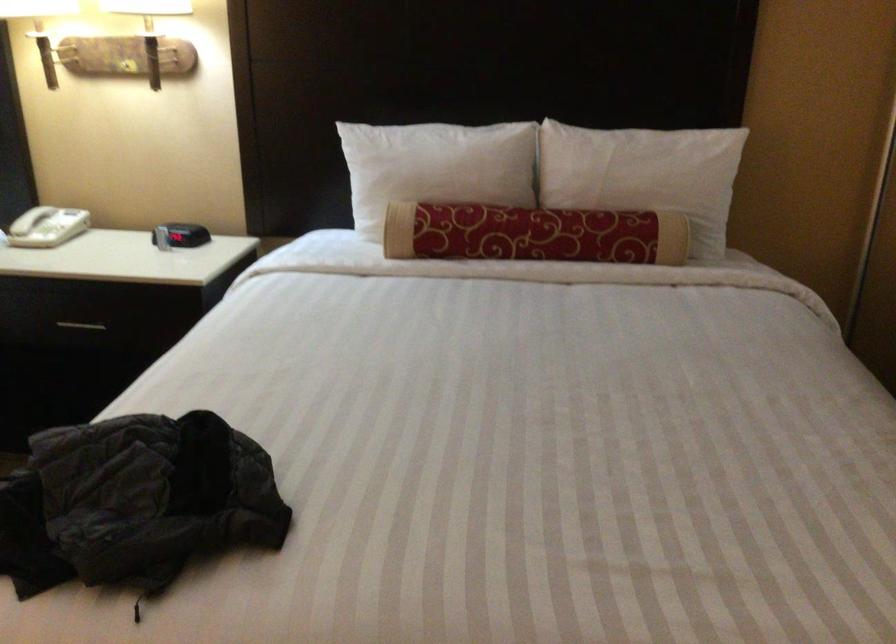
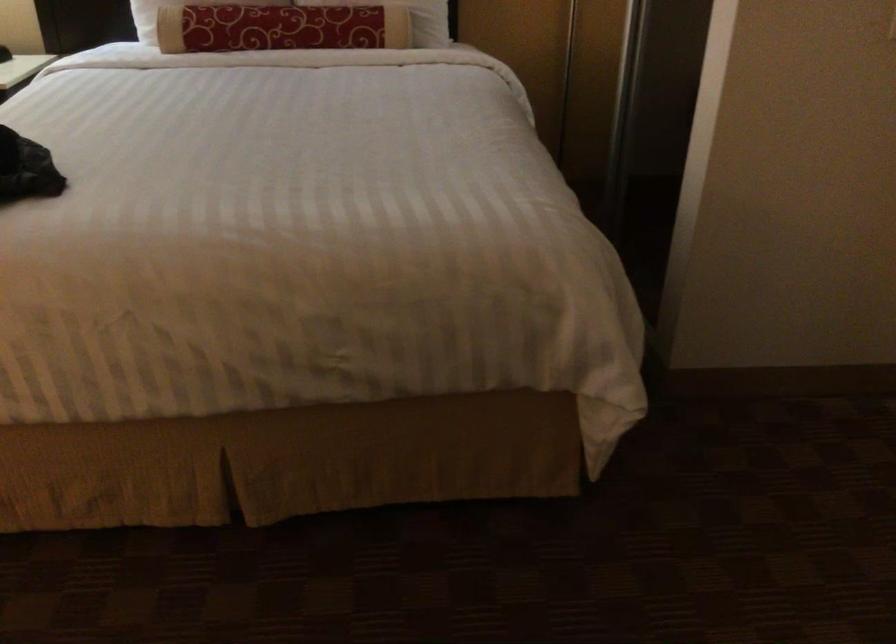
Locate, in the second image, the point that corresponds to the point at 570,220 in the first image.

(311, 15)